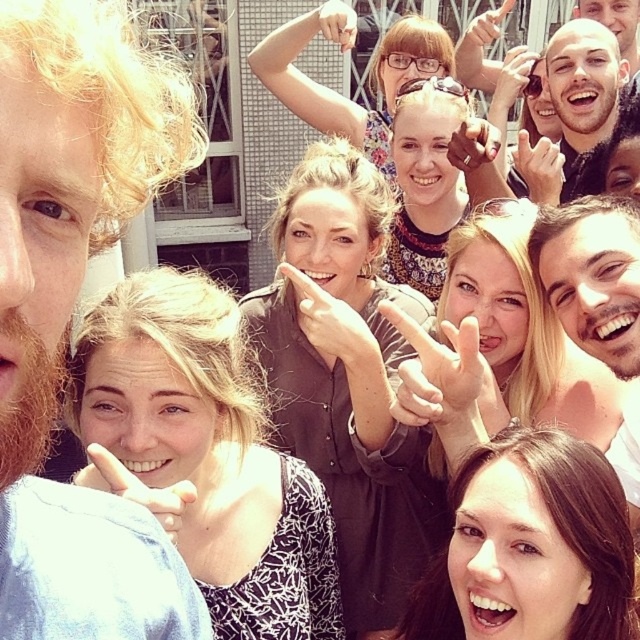
Question: Which of these objects is positioned closest to the smooth skin face at center?

Choices:
 (A) bearded man at left
 (B) bald head at center

Answer: (B)

Question: Which of the following is the farthest from the observer?

Choices:
 (A) (536, 272)
 (B) (611, 86)

Answer: (B)

Question: Which point is closer to the camera taking this photo?

Choices:
 (A) (637, 433)
 (B) (129, 128)

Answer: (B)

Question: Is bearded man at left thinner than smooth skin face at center?

Choices:
 (A) no
 (B) yes

Answer: (A)

Question: Does smooth skin face at center appear on the right side of bald head at center?

Choices:
 (A) yes
 (B) no

Answer: (B)

Question: From the image, what is the correct spatial relationship of bearded man at left in relation to smooth skin face at center?

Choices:
 (A) below
 (B) above

Answer: (B)